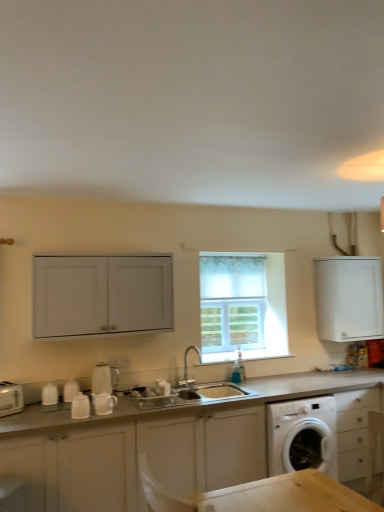
Question: From a real-world perspective, does white glossy kettle at center, acting as the third appliance starting from the left, stand above white ceramic mug at lower left, arranged as the 4th appliance when viewed from the left?

Choices:
 (A) no
 (B) yes

Answer: (B)

Question: Are white glossy kettle at center, acting as the third appliance starting from the left, and white ceramic mug at lower left, which is counted as the 1th appliance, starting from the right, far apart?

Choices:
 (A) no
 (B) yes

Answer: (A)

Question: Does white glossy kettle at center, the second appliance when ordered from right to left, come behind white ceramic mug at lower left, which is counted as the 1th appliance, starting from the right?

Choices:
 (A) yes
 (B) no

Answer: (A)

Question: Is white glossy kettle at center, the second appliance when ordered from right to left, thinner than white ceramic mug at lower left, arranged as the 4th appliance when viewed from the left?

Choices:
 (A) no
 (B) yes

Answer: (A)

Question: Does white glossy kettle at center, acting as the third appliance starting from the left, have a smaller size compared to white ceramic mug at lower left, arranged as the 4th appliance when viewed from the left?

Choices:
 (A) no
 (B) yes

Answer: (A)

Question: From their relative heights in the image, would you say silver metallic faucet at center is taller or shorter than white ceramic mug at lower left, arranged as the 4th appliance when viewed from the left?

Choices:
 (A) short
 (B) tall

Answer: (B)

Question: Considering the relative positions of silver metallic faucet at center and white ceramic mug at lower left, arranged as the 4th appliance when viewed from the left, in the image provided, is silver metallic faucet at center to the left or to the right of white ceramic mug at lower left, arranged as the 4th appliance when viewed from the left,?

Choices:
 (A) right
 (B) left

Answer: (A)

Question: Choose the correct answer: Is silver metallic faucet at center inside white ceramic mug at lower left, arranged as the 4th appliance when viewed from the left, or outside it?

Choices:
 (A) inside
 (B) outside

Answer: (B)

Question: From a real-world perspective, relative to white ceramic mug at lower left, arranged as the 4th appliance when viewed from the left, is silver metallic faucet at center vertically above or below?

Choices:
 (A) below
 (B) above

Answer: (B)

Question: Would you say white matte cabinet at upper left, the 3th cabinetry viewed from the right, is to the left or to the right of white glossy kettle at center, acting as the third appliance starting from the left, in the picture?

Choices:
 (A) left
 (B) right

Answer: (A)

Question: In terms of size, does white matte cabinet at upper left, the 1th cabinetry positioned from the top, appear bigger or smaller than white glossy kettle at center, acting as the third appliance starting from the left?

Choices:
 (A) big
 (B) small

Answer: (A)

Question: Relative to white glossy kettle at center, acting as the third appliance starting from the left, is white matte cabinet at upper left, the 1th cabinetry positioned from the top, in front or behind?

Choices:
 (A) behind
 (B) front

Answer: (B)

Question: In terms of height, does white matte cabinet at upper left, the 3th cabinetry viewed from the right, look taller or shorter compared to white glossy kettle at center, the second appliance when ordered from right to left?

Choices:
 (A) tall
 (B) short

Answer: (A)

Question: Considering the positions of point (11, 388) and point (190, 378), is point (11, 388) closer or farther from the camera than point (190, 378)?

Choices:
 (A) closer
 (B) farther

Answer: (A)

Question: Is white plastic toaster at lower left, marked as the fourth appliance in a right-to-left arrangement, spatially inside silver metallic faucet at center, or outside of it?

Choices:
 (A) inside
 (B) outside

Answer: (B)